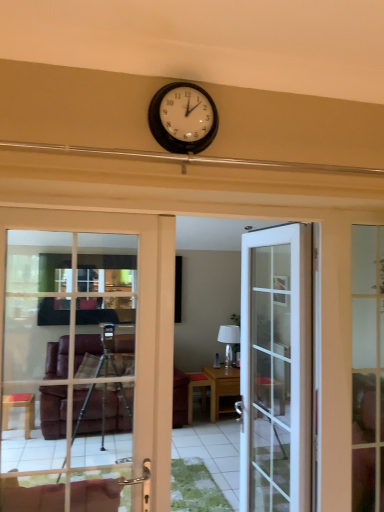
What are the coordinates of `free spot above white glass door at left, acting as the 1th door starting from the front (from a real-world perspective)` in the screenshot? It's located at (87, 209).